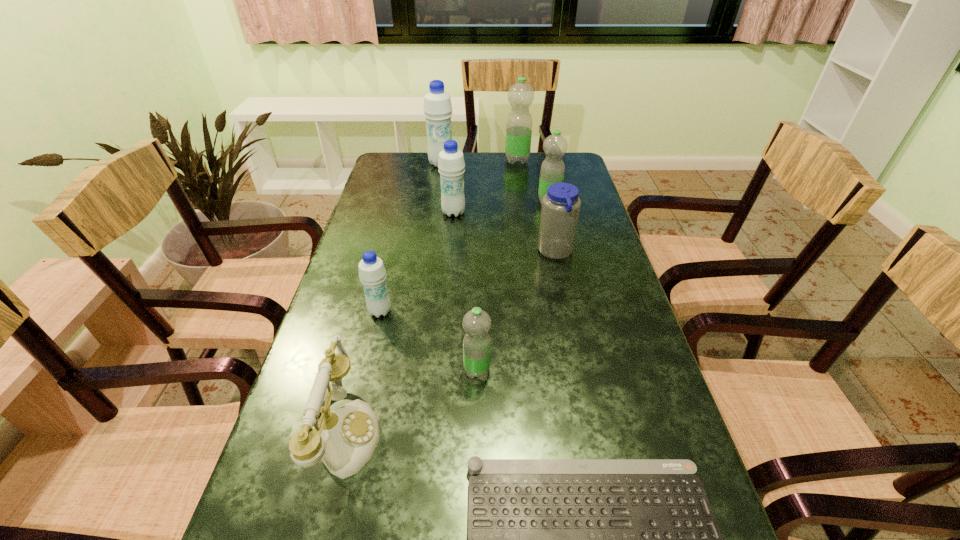
Where is `vacant space in between the white telephone and the smallest green water bottle`? This screenshot has width=960, height=540. vacant space in between the white telephone and the smallest green water bottle is located at coordinates (411, 401).

Locate an element on the screen. The height and width of the screenshot is (540, 960). free space between the biggest blue water bottle and the biggest green water bottle is located at coordinates (479, 162).

At what (x,y) coordinates should I click in order to perform the action: click on free space between the farthest blue water bottle and the sixth farthest object. Please return your answer as a coordinate pair (x, y). Looking at the image, I should click on (411, 237).

Identify the location of free point between the biggest green water bottle and the third smallest blue water bottle. (486, 186).

Locate an element on the screen. The height and width of the screenshot is (540, 960). free area in between the nearest water bottle and the biggest green water bottle is located at coordinates (497, 265).

Identify the location of the eighth closest object relative to the nearest green water bottle. (520, 95).

Identify the location of the second closest object to the computer keyboard. (476, 323).

Locate which water bottle is the fifth closest to the computer keyboard. Please provide its 2D coordinates. Your answer should be formatted as a tuple, i.e. [(x, y)], where the tuple contains the x and y coordinates of a point satisfying the conditions above.

[(552, 170)]

Find the location of `water bottle identified as the third closest to the farthest green water bottle`. water bottle identified as the third closest to the farthest green water bottle is located at coordinates (451, 164).

Image resolution: width=960 pixels, height=540 pixels. Find the location of `green water bottle object that ranks as the second closest to the white telephone`. green water bottle object that ranks as the second closest to the white telephone is located at coordinates (552, 170).